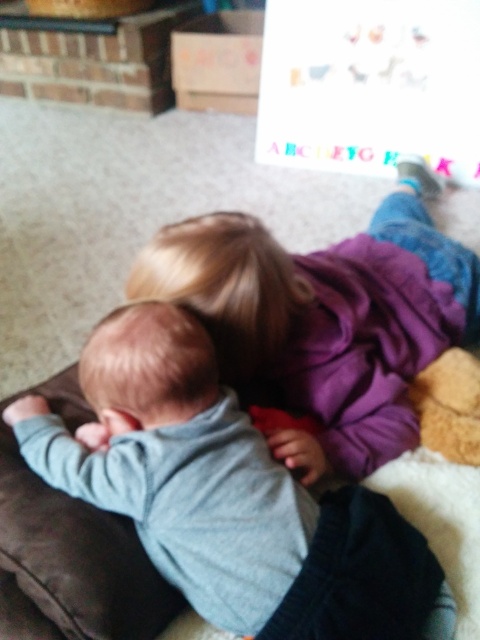
Question: Can you confirm if gray soft baby at upper left is thinner than matte purple sweater at upper center?

Choices:
 (A) no
 (B) yes

Answer: (B)

Question: Among these points, which one is farthest from the camera?

Choices:
 (A) tap(272, 497)
 (B) tap(364, 416)

Answer: (B)

Question: Is gray soft baby at upper left bigger than matte purple sweater at upper center?

Choices:
 (A) yes
 (B) no

Answer: (B)

Question: Does gray soft baby at upper left have a lesser width compared to matte purple sweater at upper center?

Choices:
 (A) no
 (B) yes

Answer: (B)